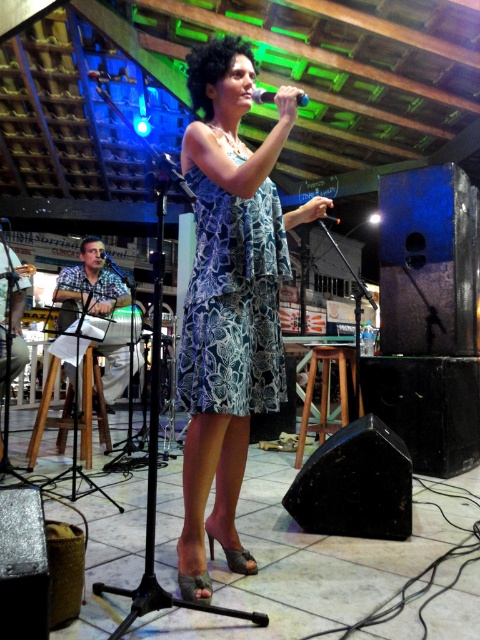
You are a stagehand who needs to place a new microphone stand in the center of the stage. The stage is represented by a coordinate system where the bottom left corner is the origin point. The wooden stool at center is located at point (325, 392). Where should you place the microphone stand to ensure it is directly in front of the wooden stool at center?

The wooden stool at center is located at point (325, 392). To place the microphone stand directly in front of it, you should position it along the same vertical line but slightly closer to the front of the stage. However, without additional information about the stage dimensions or orientation, the exact coordinates cannot be determined with certainty. A reasonable approximation would be to place it at a point like 0.614, 0.579, assuming the Y coordinate decreases towards the front.

You are a stagehand adjusting the lighting for the performance. You need to ensure the wooden stool at center is properly lit so it doesn not cast a shadow on the metallic silver microphone at upper center. Given the current setup, is the stool positioned in a way that might cause a shadow on the microphone?

The wooden stool at center is positioned under the metallic silver microphone at upper center, so it will cast a shadow on the microphone if the light source is above it. Adjust the stool or lighting to avoid obstruction.

You are a stagehand who needs to place a new amplifier that is 1.2 meters wide. You have space between the wooden stool at center and the metallic silver microphone at upper center. Can the amplifier fit in that space?

The wooden stool at center is wider than the metallic silver microphone at upper center. Since the amplifier is 1.2 meters wide, but the exact width of the space between them isn